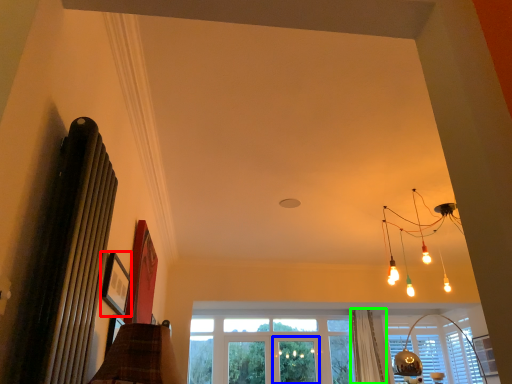
Question: Estimate the real-world distances between objects in this image. Which object is farther from picture frame (highlighted by a red box), screen door (highlighted by a blue box) or curtain (highlighted by a green box)?

Choices:
 (A) screen door
 (B) curtain

Answer: (A)